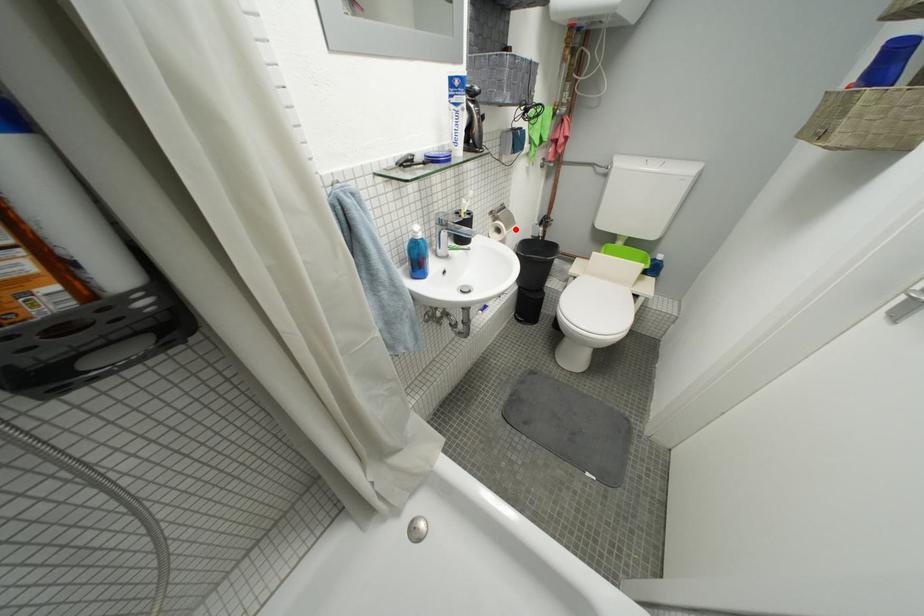
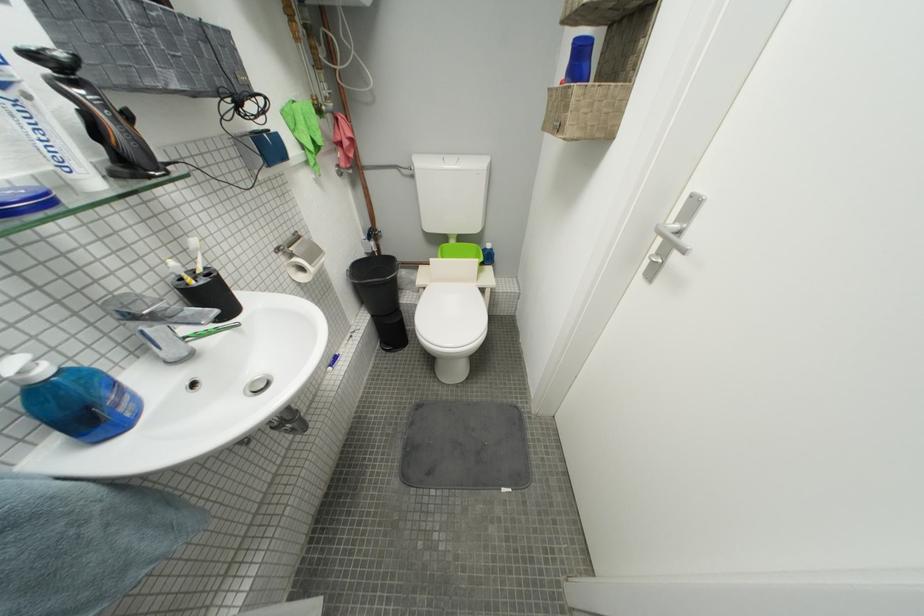
Question: I am providing you with two images of the same scene from different viewpoints. In image1, a red point is highlighted. Considering the same 3D point in image2, which of the following is correct?

Choices:
 (A) It is closer
 (B) It is farther

Answer: (A)